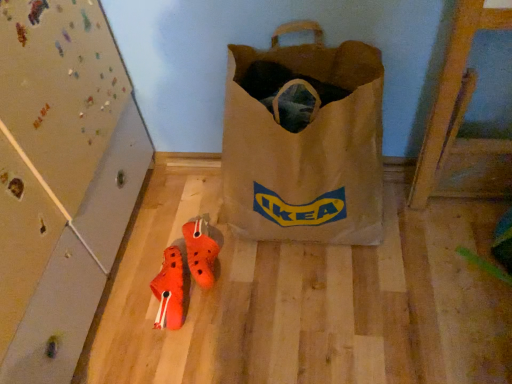
Question: From the image's perspective, is orange matte sneakers at lower center, arranged as the first footwear when viewed from the left, above orange rubber clogs at center, the 1th footwear viewed from the right?

Choices:
 (A) yes
 (B) no

Answer: (B)

Question: Does orange matte sneakers at lower center, arranged as the first footwear when viewed from the left, appear on the right side of orange rubber clogs at center, the 2th footwear from the left?

Choices:
 (A) yes
 (B) no

Answer: (B)

Question: Is orange matte sneakers at lower center, placed as the second footwear when sorted from right to left, with orange rubber clogs at center, the 1th footwear viewed from the right?

Choices:
 (A) yes
 (B) no

Answer: (A)

Question: Does orange matte sneakers at lower center, arranged as the first footwear when viewed from the left, have a greater width compared to orange rubber clogs at center, the 1th footwear viewed from the right?

Choices:
 (A) yes
 (B) no

Answer: (B)

Question: Is orange matte sneakers at lower center, placed as the second footwear when sorted from right to left, at the left side of orange rubber clogs at center, the 1th footwear viewed from the right?

Choices:
 (A) yes
 (B) no

Answer: (A)

Question: From a real-world perspective, is orange matte sneakers at lower center, placed as the second footwear when sorted from right to left, under orange rubber clogs at center, the 1th footwear viewed from the right?

Choices:
 (A) no
 (B) yes

Answer: (B)

Question: Considering the relative sizes of orange rubber clogs at center, the 2th footwear from the left, and brown paper bag at center in the image provided, is orange rubber clogs at center, the 2th footwear from the left, thinner than brown paper bag at center?

Choices:
 (A) no
 (B) yes

Answer: (B)

Question: Is orange rubber clogs at center, the 2th footwear from the left, located outside brown paper bag at center?

Choices:
 (A) no
 (B) yes

Answer: (B)

Question: Considering the relative sizes of orange rubber clogs at center, the 2th footwear from the left, and brown paper bag at center in the image provided, is orange rubber clogs at center, the 2th footwear from the left, wider than brown paper bag at center?

Choices:
 (A) yes
 (B) no

Answer: (B)

Question: Does orange rubber clogs at center, the 1th footwear viewed from the right, have a lesser height compared to brown paper bag at center?

Choices:
 (A) yes
 (B) no

Answer: (A)

Question: Does orange rubber clogs at center, the 2th footwear from the left, have a smaller size compared to brown paper bag at center?

Choices:
 (A) no
 (B) yes

Answer: (B)

Question: Is orange rubber clogs at center, the 1th footwear viewed from the right, oriented away from brown paper bag at center?

Choices:
 (A) no
 (B) yes

Answer: (A)

Question: Considering the relative sizes of orange matte sneakers at lower center, arranged as the first footwear when viewed from the left, and brown paper bag at center in the image provided, is orange matte sneakers at lower center, arranged as the first footwear when viewed from the left, shorter than brown paper bag at center?

Choices:
 (A) yes
 (B) no

Answer: (A)